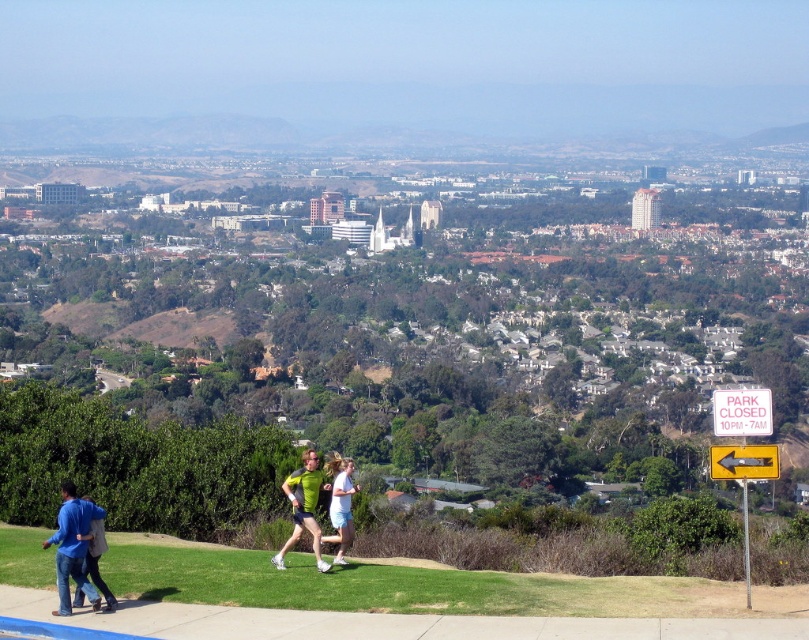
Who is more distant from viewer, (350, 540) or (78, 602)?

The point (350, 540) is more distant.

How far apart are light blue denim shorts at center and blue cotton jacket at lower left?

They are 77.09 meters apart.

Identify the location of light blue denim shorts at center. Image resolution: width=809 pixels, height=640 pixels. (341, 506).

The image size is (809, 640). In order to click on green fabric shirt at center in this screenshot , I will do `click(303, 508)`.

Measure the distance between green fabric shirt at center and blue cotton jacket at lower left.

green fabric shirt at center and blue cotton jacket at lower left are 180.18 feet apart.

Locate an element on the screen. green fabric shirt at center is located at coordinates [303, 508].

Where is `green fabric shirt at center`? green fabric shirt at center is located at coordinates (303, 508).

Looking at this image, between blue denim jacket at lower left and light blue denim shorts at center, which one is positioned higher?

Positioned higher is blue denim jacket at lower left.

Is blue denim jacket at lower left taller than light blue denim shorts at center?

No.

Does point (62, 552) come in front of point (341, 488)?

Yes, it is in front of point (341, 488).

The width and height of the screenshot is (809, 640). In order to click on blue denim jacket at lower left in this screenshot , I will do `click(71, 547)`.